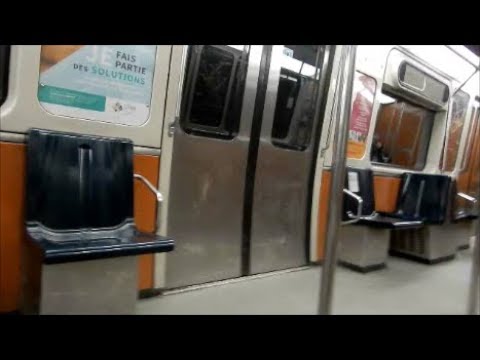
What are the coordinates of `wall` in the screenshot? It's located at (136, 212).